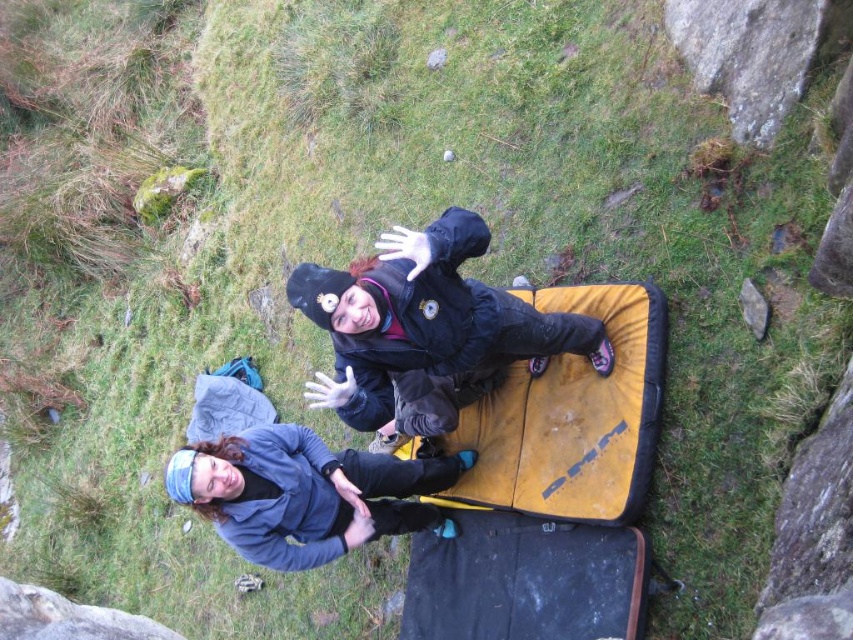
Can you confirm if yellow fabric mat at center is positioned above blue fleece jacket at lower center?

Yes, yellow fabric mat at center is above blue fleece jacket at lower center.

Does yellow fabric mat at center have a lesser height compared to blue fleece jacket at lower center?

No.

At what (x,y) coordinates should I click in order to perform the action: click on yellow fabric mat at center. Please return your answer as a coordinate pair (x, y). The height and width of the screenshot is (640, 853). Looking at the image, I should click on (572, 417).

Does yellow fabric mat at center appear on the left side of black matte jacket at center?

In fact, yellow fabric mat at center is to the right of black matte jacket at center.

Measure the distance between point (612, 410) and camera.

Point (612, 410) is 12.41 feet away from camera.

What do you see at coordinates (572, 417) in the screenshot? I see `yellow fabric mat at center` at bounding box center [572, 417].

This screenshot has width=853, height=640. I want to click on yellow fabric mat at center, so (x=572, y=417).

Is yellow fabric mat at center shorter than smooth gray rock at lower left?

No, yellow fabric mat at center is not shorter than smooth gray rock at lower left.

Measure the distance between point (637, 305) and camera.

Point (637, 305) is 3.86 meters from camera.

At what (x,y) coordinates should I click in order to perform the action: click on yellow fabric mat at center. Please return your answer as a coordinate pair (x, y). Looking at the image, I should click on (572, 417).